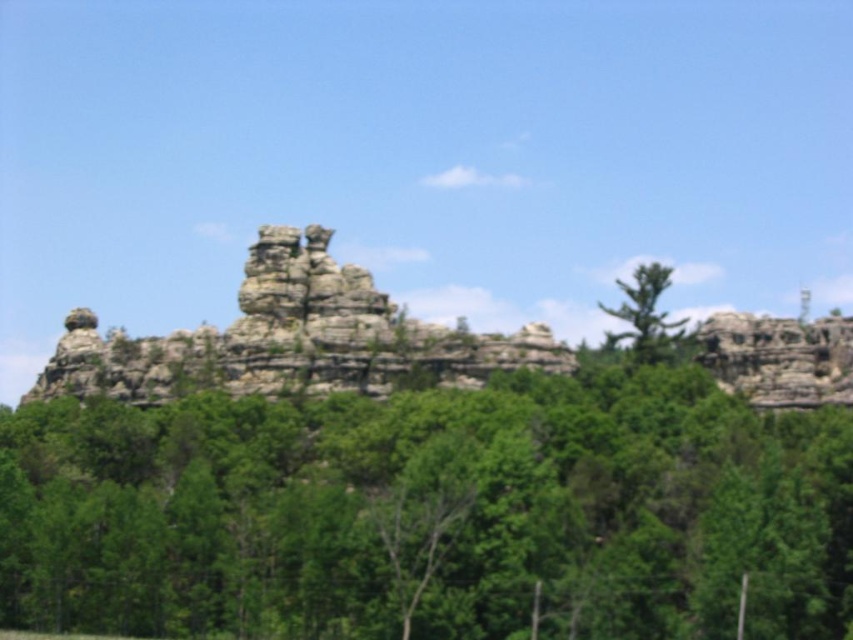
Find the location of a particular element. green leafy tree at center is located at coordinates (431, 513).

Is point (35, 572) closer to viewer compared to point (671, 332)?

That is True.

This screenshot has height=640, width=853. Identify the location of green leafy tree at center. (431, 513).

Does rocky cliff at center appear on the left side of green textured tree at upper right?

Yes, rocky cliff at center is to the left of green textured tree at upper right.

Which of these two, rocky cliff at center or green textured tree at upper right, stands taller?

rocky cliff at center

The height and width of the screenshot is (640, 853). I want to click on rocky cliff at center, so click(289, 339).

Which of these two, green leafy tree at center or rocky cliff at center, stands taller?

With more height is green leafy tree at center.

I want to click on green leafy tree at center, so click(431, 513).